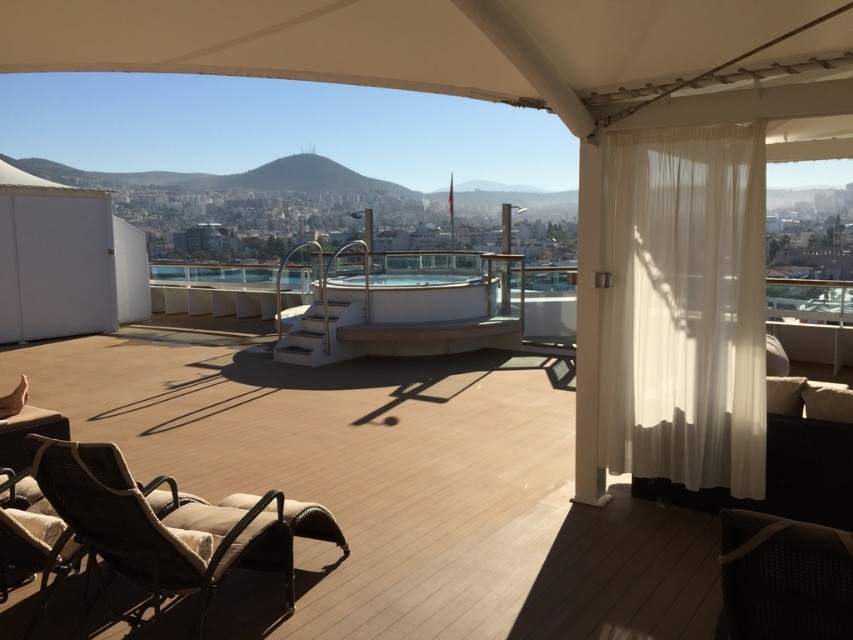
Question: Which is farther from the dark brown woven armchair at lower right?

Choices:
 (A) white sheer curtain at right
 (B) brown woven armchair at lower left

Answer: (B)

Question: Is brown woven armchair at lower left bigger than dark brown woven armchair at lower right?

Choices:
 (A) yes
 (B) no

Answer: (A)

Question: Which point is closer to the camera?

Choices:
 (A) (611, 340)
 (B) (756, 628)
 (C) (61, 493)

Answer: (B)

Question: Is white sheer curtain at right to the right of dark brown woven armchair at lower right from the viewer's perspective?

Choices:
 (A) no
 (B) yes

Answer: (B)

Question: Which point is farther to the camera?

Choices:
 (A) (773, 580)
 (B) (229, 536)
 (C) (704, 168)

Answer: (C)

Question: Does white sheer curtain at right have a smaller size compared to brown woven armchair at lower left?

Choices:
 (A) no
 (B) yes

Answer: (B)